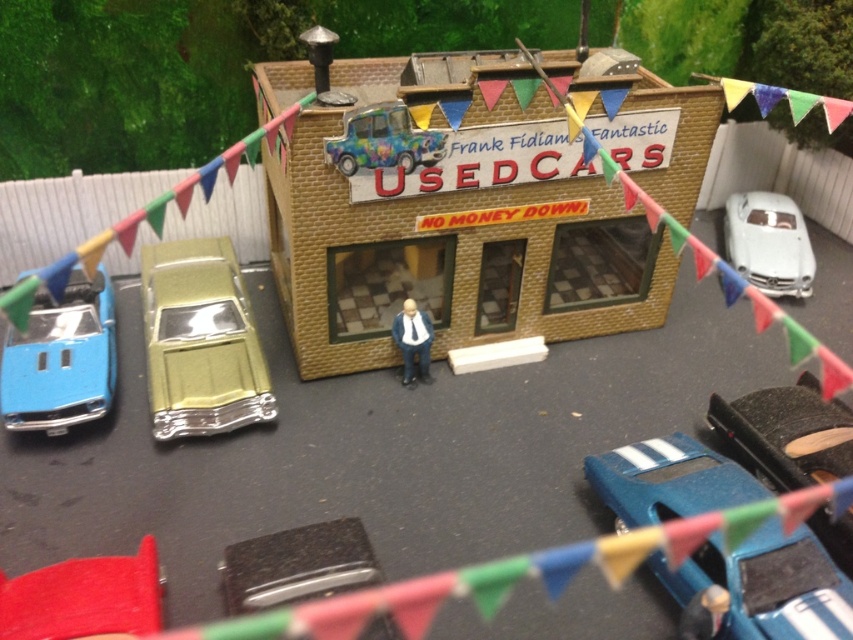
Question: Is matte blue car at left below white glossy car at right?

Choices:
 (A) yes
 (B) no

Answer: (A)

Question: Which object is positioned farthest from the psychedelic paint car at center?

Choices:
 (A) rubberized red car at lower left
 (B) smooth beige suit at center
 (C) metallic blue car at lower right
 (D) matte blue car at left

Answer: (A)

Question: In this image, where is matte blue car at left located relative to rubberized red car at lower left?

Choices:
 (A) above
 (B) below

Answer: (A)

Question: Which is farther from the metallic gold car at left?

Choices:
 (A) matte blue car at left
 (B) psychedelic paint car at center
 (C) brick building at center

Answer: (B)

Question: Which of these objects is positioned farthest from the smooth beige suit at center?

Choices:
 (A) white glossy car at right
 (B) metallic blue car at lower right
 (C) metallic gold car at left

Answer: (A)

Question: Can you confirm if metallic blue car at lower right is smaller than rubberized red car at lower left?

Choices:
 (A) yes
 (B) no

Answer: (B)